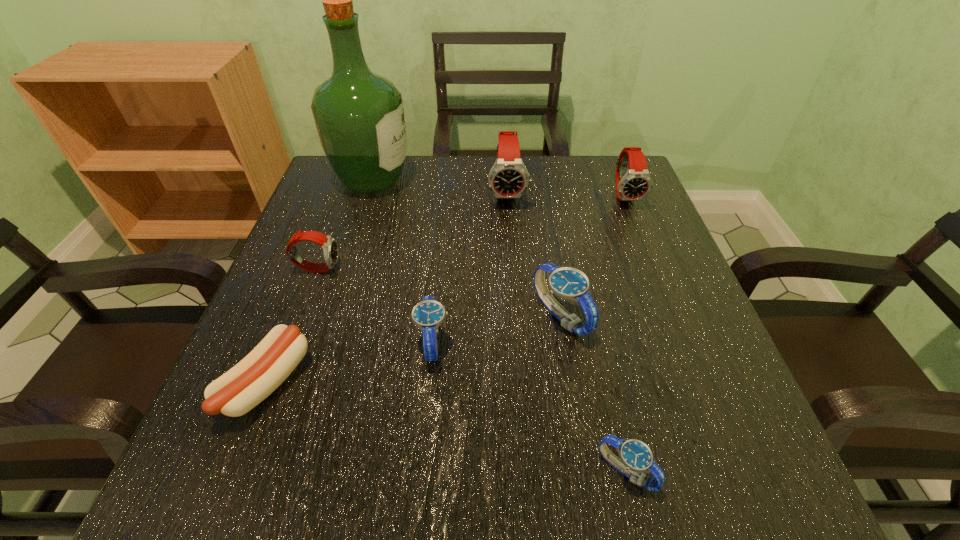
Select which blue watch is the second closest to the biggest blue watch. Please provide its 2D coordinates. Your answer should be formatted as a tuple, i.e. [(x, y)], where the tuple contains the x and y coordinates of a point satisfying the conditions above.

[(636, 457)]

Choose which blue watch is the second nearest neighbor to the fifth shortest watch. Please provide its 2D coordinates. Your answer should be formatted as a tuple, i.e. [(x, y)], where the tuple contains the x and y coordinates of a point satisfying the conditions above.

[(428, 314)]

You are a GUI agent. You are given a task and a screenshot of the screen. Output one action in this format:
    pyautogui.click(x=<x>, y=<y>)
    Task: Click on the vacant space that satisfies the following two spatial constraints: 1. on the front-facing side of the liquor; 2. on the left side of the third shortest object
    
    Given the screenshot: What is the action you would take?
    pyautogui.click(x=323, y=341)

Identify the location of vacant point that satisfies the following two spatial constraints: 1. on the face of the smallest red watch; 2. on the left side of the fifth watch from right to left. (290, 341).

You are a GUI agent. You are given a task and a screenshot of the screen. Output one action in this format:
    pyautogui.click(x=<x>, y=<y>)
    Task: Click on the free location that satisfies the following two spatial constraints: 1. on the front-facing side of the second watch from left to right; 2. on the right side of the tallest object
    Image resolution: width=960 pixels, height=540 pixels.
    Given the screenshot: What is the action you would take?
    pyautogui.click(x=323, y=341)

Locate an element on the screen. free space that satisfies the following two spatial constraints: 1. on the front-facing side of the tallest object; 2. on the back side of the second shortest watch is located at coordinates (323, 341).

Locate an element on the screen. Image resolution: width=960 pixels, height=540 pixels. free space that satisfies the following two spatial constraints: 1. on the front-facing side of the biggest blue watch; 2. on the left side of the green liquor is located at coordinates (330, 316).